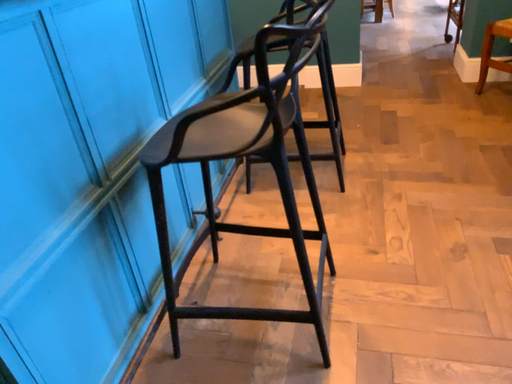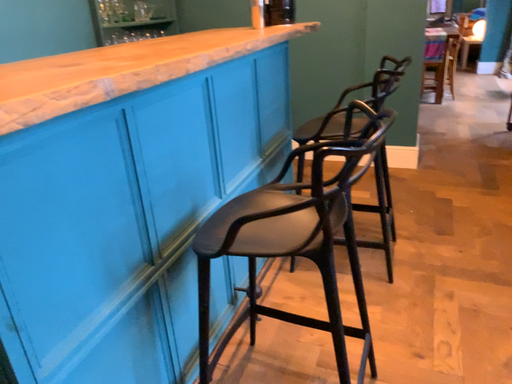
Question: Which way did the camera rotate in the video?

Choices:
 (A) rotated upward
 (B) rotated downward

Answer: (A)